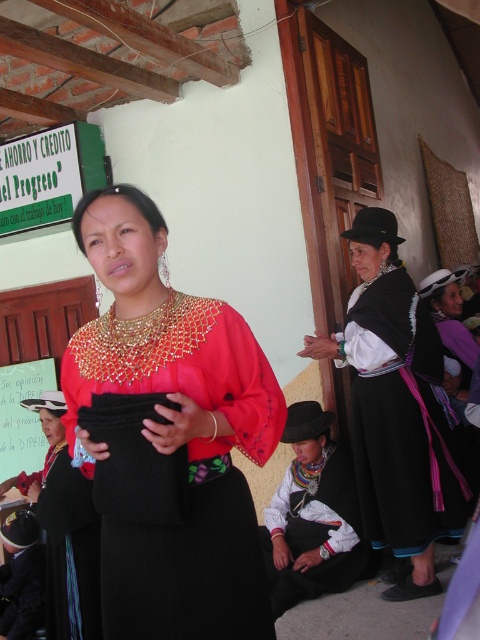
Question: Observing the image, what is the correct spatial positioning of black satin dress at center in reference to matte black dress at center?

Choices:
 (A) below
 (B) above

Answer: (B)

Question: Which point is farther to the camera?

Choices:
 (A) (384, 512)
 (B) (204, 444)

Answer: (A)

Question: Does white woven fabric at lower center lie behind matte black dress at center?

Choices:
 (A) no
 (B) yes

Answer: (A)

Question: Which point is farther from the camera taking this photo?

Choices:
 (A) (444, 468)
 (B) (51, 550)
 (C) (299, 540)
 (D) (200, 508)

Answer: (C)

Question: Which point is farther to the camera?

Choices:
 (A) (70, 586)
 (B) (350, 316)

Answer: (B)

Question: Is matte gold necklace at center further to the viewer compared to black satin dress at center?

Choices:
 (A) no
 (B) yes

Answer: (A)